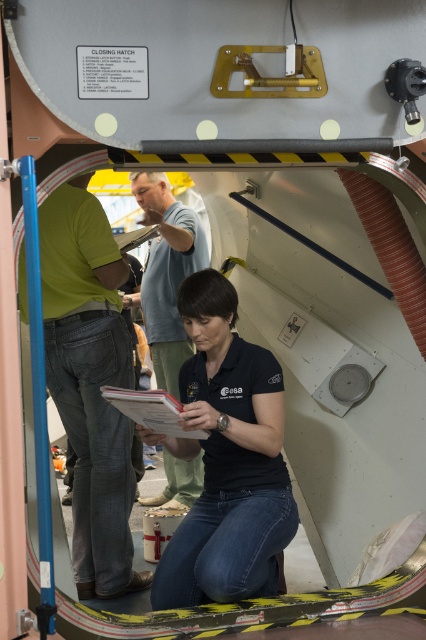
Question: Can you confirm if white paper clipboard at lower center is positioned above matte white clipboard at center?

Choices:
 (A) yes
 (B) no

Answer: (B)

Question: Does black matte shirt at center lie behind white paper clipboard at lower center?

Choices:
 (A) yes
 (B) no

Answer: (B)

Question: Which point is farther from the camera taking this photo?

Choices:
 (A) (123, 252)
 (B) (92, 422)
 (C) (108, 388)

Answer: (A)

Question: Which of the following is the farthest from the observer?

Choices:
 (A) (154, 422)
 (B) (209, 371)

Answer: (B)

Question: From the image, what is the correct spatial relationship of black matte shirt at center in relation to light blue t-shirt at center?

Choices:
 (A) right
 (B) left

Answer: (A)

Question: Which point is farther to the camera?

Choices:
 (A) light blue t-shirt at center
 (B) green matte shirt at left
 (C) black matte shirt at center
 (D) matte white clipboard at center

Answer: (D)